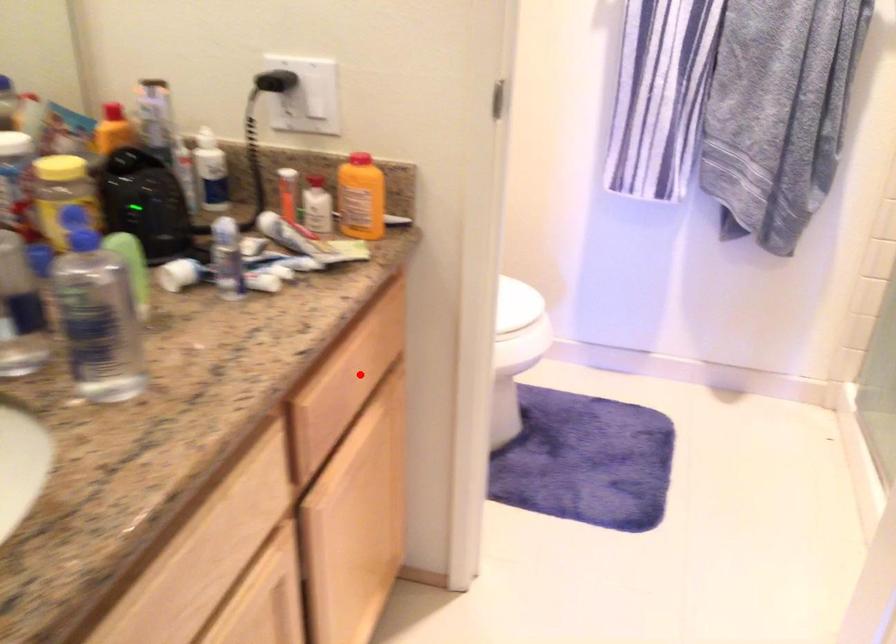
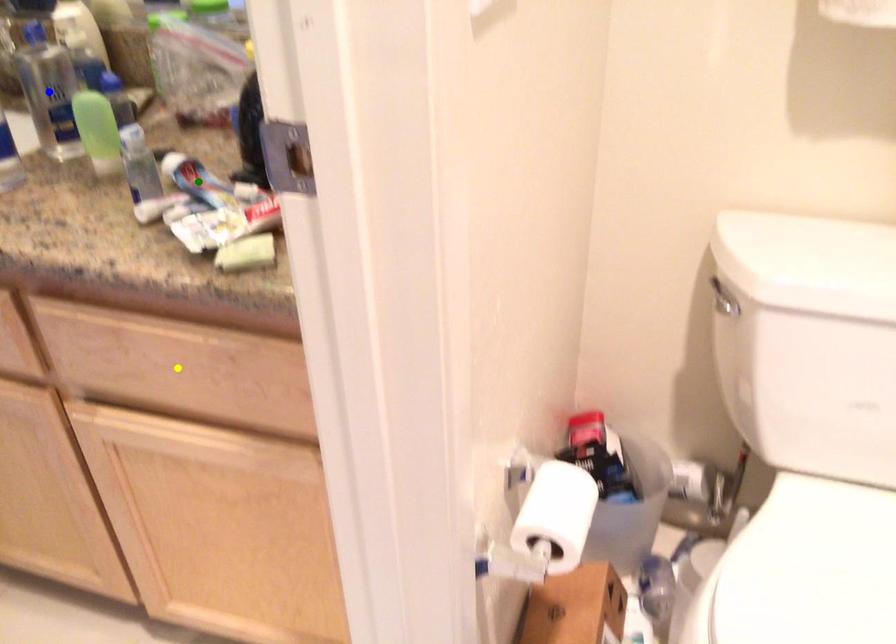
Question: I am providing you with two images of the same scene from different viewpoints. A red point is marked on the first image. You are given multiple points on the second image. Can you choose the point in image 2 that corresponds to the point in image 1?

Choices:
 (A) yellow point
 (B) blue point
 (C) green point

Answer: (A)